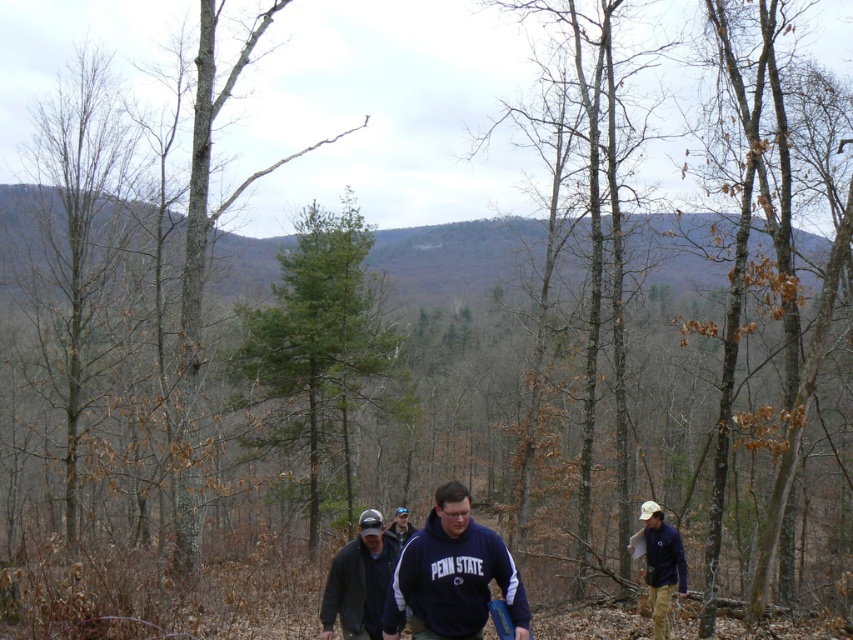
Who is positioned more to the right, blue fabric jacket at lower right or dark blue cotton shirt at center?

blue fabric jacket at lower right

Does blue fabric jacket at lower right lie behind dark blue cotton shirt at center?

Yes, it is.

Does point (653, 556) come farther from viewer compared to point (397, 515)?

No.

Where is `blue fabric jacket at lower right`? blue fabric jacket at lower right is located at coordinates (660, 564).

Is the position of navy blue sweatshirt at center more distant than that of blue fabric jacket at lower right?

No, navy blue sweatshirt at center is closer to the viewer.

Does navy blue sweatshirt at center appear over blue fabric jacket at lower right?

Indeed, navy blue sweatshirt at center is positioned over blue fabric jacket at lower right.

Identify the location of navy blue sweatshirt at center. The height and width of the screenshot is (640, 853). (451, 573).

Find the location of `navy blue sweatshirt at center`. navy blue sweatshirt at center is located at coordinates (451, 573).

Does dark gray jacket at center have a larger size compared to dark blue cotton shirt at center?

Actually, dark gray jacket at center might be smaller than dark blue cotton shirt at center.

Does dark gray jacket at center lie in front of dark blue cotton shirt at center?

Yes, it is in front of dark blue cotton shirt at center.

Where is `dark gray jacket at center`? dark gray jacket at center is located at coordinates (358, 580).